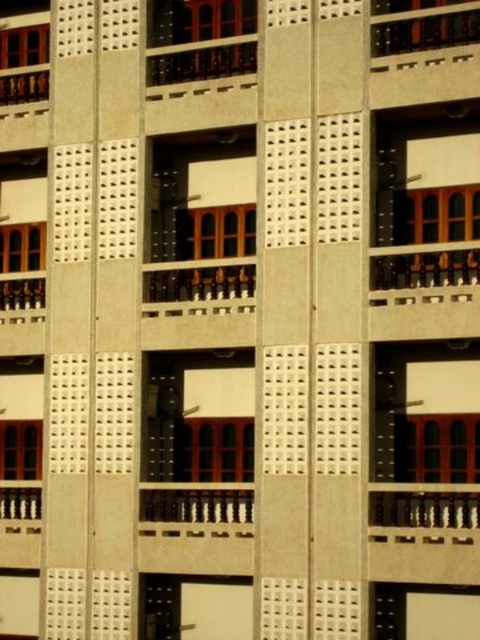
Can you confirm if matte wood window at upper right is positioned to the right of dark brown wooden balcony at upper center?

Correct, you'll find matte wood window at upper right to the right of dark brown wooden balcony at upper center.

Describe the element at coordinates (437, 214) in the screenshot. I see `matte wood window at upper right` at that location.

Which is in front, point (447, 192) or point (180, 54)?

Point (447, 192) is more forward.

This screenshot has width=480, height=640. Find the location of `matte wood window at upper right`. matte wood window at upper right is located at coordinates (437, 214).

Between point (203, 52) and point (418, 232), which one is positioned behind?

Point (203, 52)

Which of these two, matte wood window at upper center or matte wood window at upper right, stands taller?

matte wood window at upper right is taller.

Locate an element on the screen. This screenshot has height=640, width=480. matte wood window at upper center is located at coordinates (203, 20).

The image size is (480, 640). Identify the location of matte wood window at upper center. (203, 20).

Who is positioned more to the left, matte wood window at upper right or matte brown wood window at lower left?

matte brown wood window at lower left is more to the left.

Does point (468, 198) come behind point (34, 436)?

No, (468, 198) is in front of (34, 436).

Locate an element on the screen. The height and width of the screenshot is (640, 480). matte wood window at upper right is located at coordinates (437, 214).